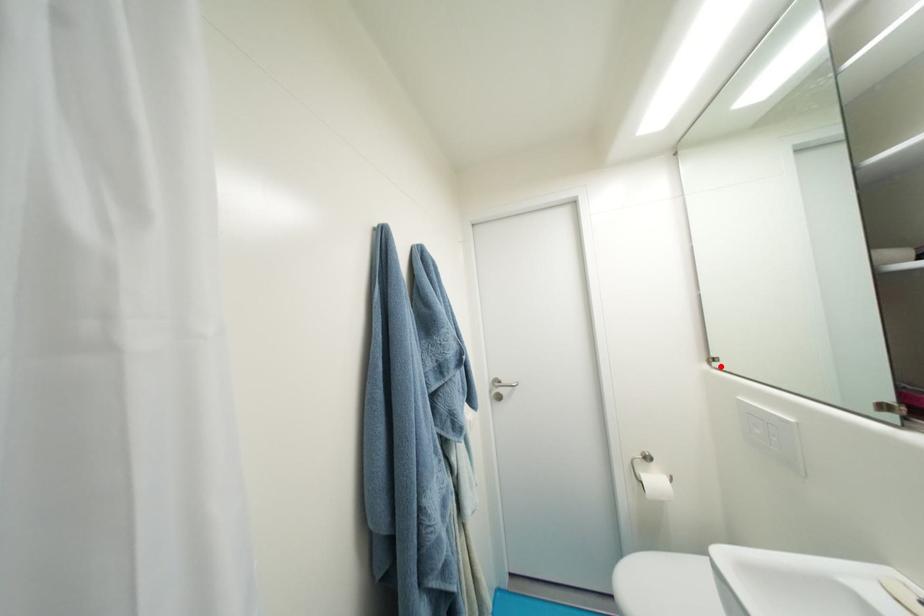
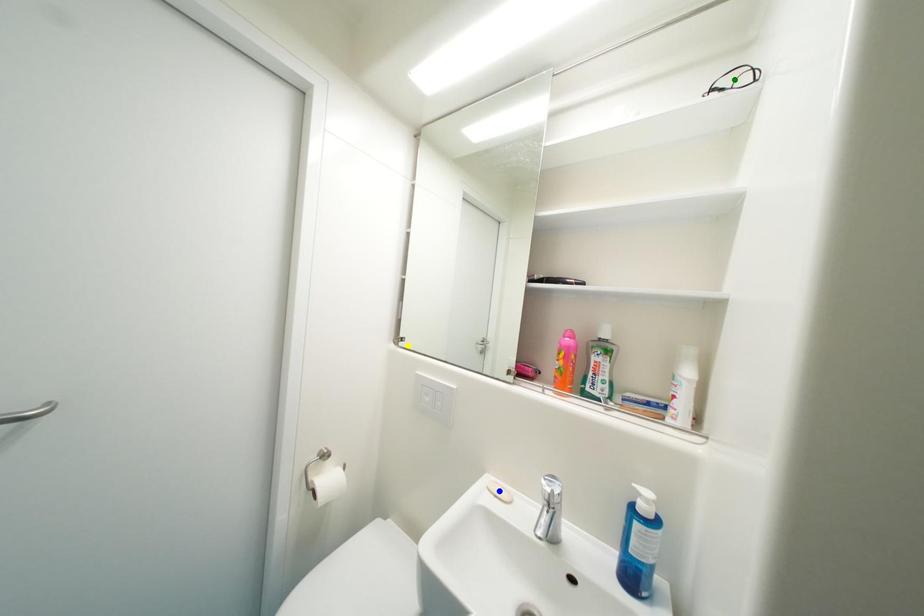
Question: I am providing you with two images of the same scene from different viewpoints. A red point is marked on the first image. You are given multiple points on the second image. In image 2, which mark is for the same physical point as the one in image 1?

Choices:
 (A) blue point
 (B) green point
 (C) yellow point

Answer: (C)